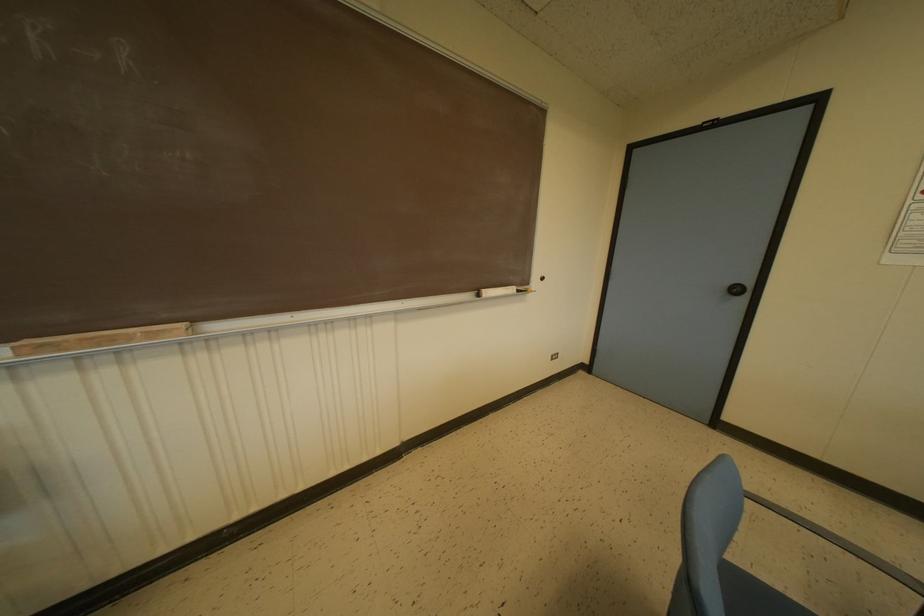
Find where to lift the piece of chalk. Please return your answer as a coordinate pair (x, y).

(503, 291)